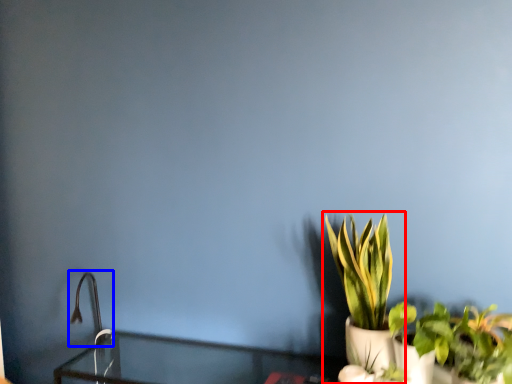
Question: Which object is further to the camera taking this photo, houseplant (highlighted by a red box) or faucet (highlighted by a blue box)?

Choices:
 (A) houseplant
 (B) faucet

Answer: (B)